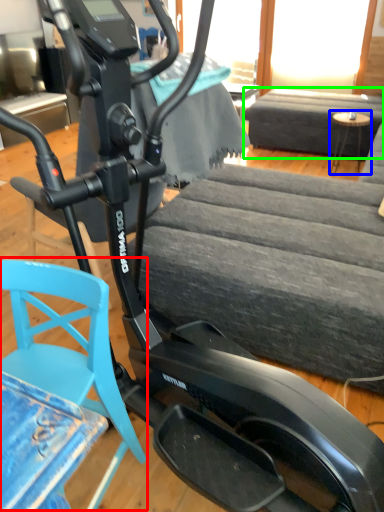
Question: Estimate the real-world distances between objects in this image. Which object is closer to swivel chair (highlighted by a red box), table (highlighted by a blue box) or couch (highlighted by a green box)?

Choices:
 (A) table
 (B) couch

Answer: (A)